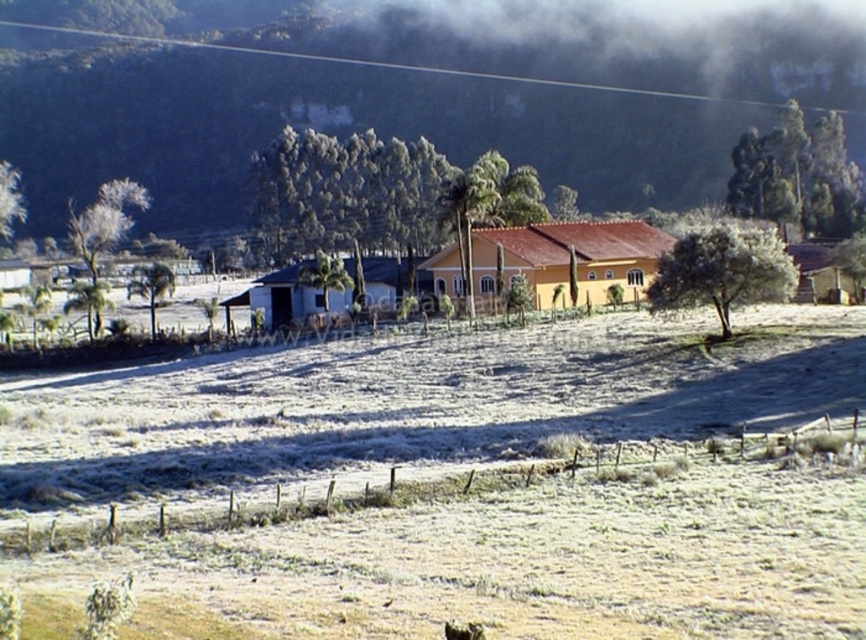
Question: Does white frosty field at center have a greater width compared to white matte hut at center?

Choices:
 (A) no
 (B) yes

Answer: (B)

Question: Among these points, which one is nearest to the camera?

Choices:
 (A) (818, 577)
 (B) (314, 300)

Answer: (A)

Question: Which object is closer to the camera taking this photo?

Choices:
 (A) yellow matte house at center
 (B) white matte hut at center

Answer: (A)

Question: Does white frosty field at center have a greater width compared to white matte hut at center?

Choices:
 (A) yes
 (B) no

Answer: (A)

Question: Does white frosty field at center have a larger size compared to yellow matte house at center?

Choices:
 (A) yes
 (B) no

Answer: (A)

Question: Which point appears farthest from the camera in this image?

Choices:
 (A) (530, 150)
 (B) (803, 385)
 (C) (307, 260)

Answer: (A)